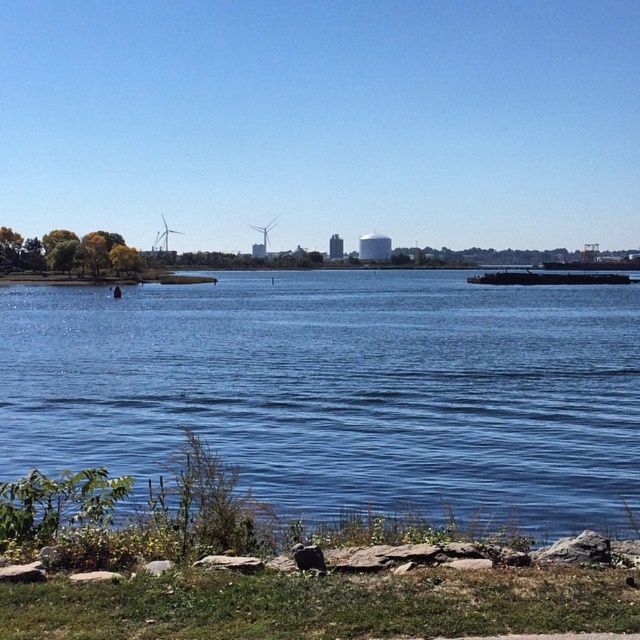
You are a photographer planning to capture the white matte wind turbine at left and the white matte wind turbine at center in a single frame. Based on their positions, which turbine would appear larger in your photo?

The white matte wind turbine at left might appear larger in the photo because it is positioned closer to the camera than the white matte wind turbine at center, making it wider in the frame.